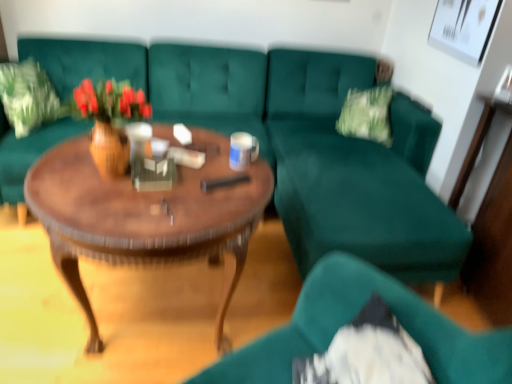
Where is `vacant area to the right of wooden vase with flowers at center`? The width and height of the screenshot is (512, 384). vacant area to the right of wooden vase with flowers at center is located at coordinates (189, 183).